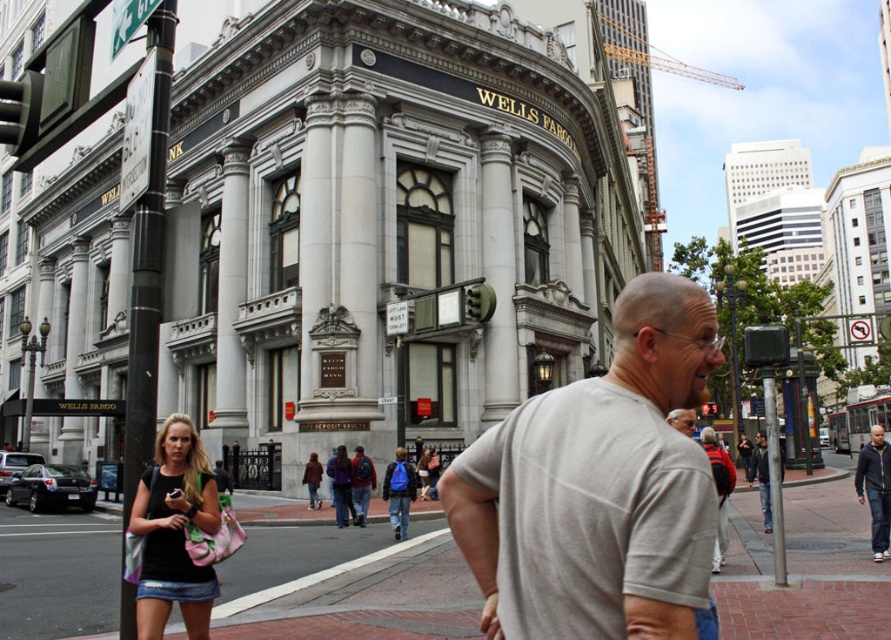
Is point (861, 618) more distant than point (869, 508)?

No, (861, 618) is in front of (869, 508).

Who is more forward, (x=241, y=584) or (x=879, y=499)?

Point (x=241, y=584) is in front.

Between point (791, 524) and point (879, 540), which one is positioned behind?

Positioned behind is point (791, 524).

You are a GUI agent. You are given a task and a screenshot of the screen. Output one action in this format:
    pyautogui.click(x=<x>, y=<y>)
    Task: Click on the brick pavement at center
    This screenshot has width=891, height=640.
    Given the screenshot: What is the action you would take?
    pyautogui.click(x=347, y=584)

Does gray cotton t-shirt at center appear on the left side of purple fabric backpack at center?

Incorrect, gray cotton t-shirt at center is not on the left side of purple fabric backpack at center.

Between point (650, 452) and point (365, 502), which one is positioned in front?

Positioned in front is point (650, 452).

Identify the location of gray cotton t-shirt at center. This screenshot has width=891, height=640. (597, 486).

Does brick pavement at center have a lesser width compared to black denim shorts at lower left?

No, brick pavement at center is not thinner than black denim shorts at lower left.

Is point (298, 605) less distant than point (198, 621)?

No, it is not.

Locate an element on the screen. The image size is (891, 640). brick pavement at center is located at coordinates (347, 584).